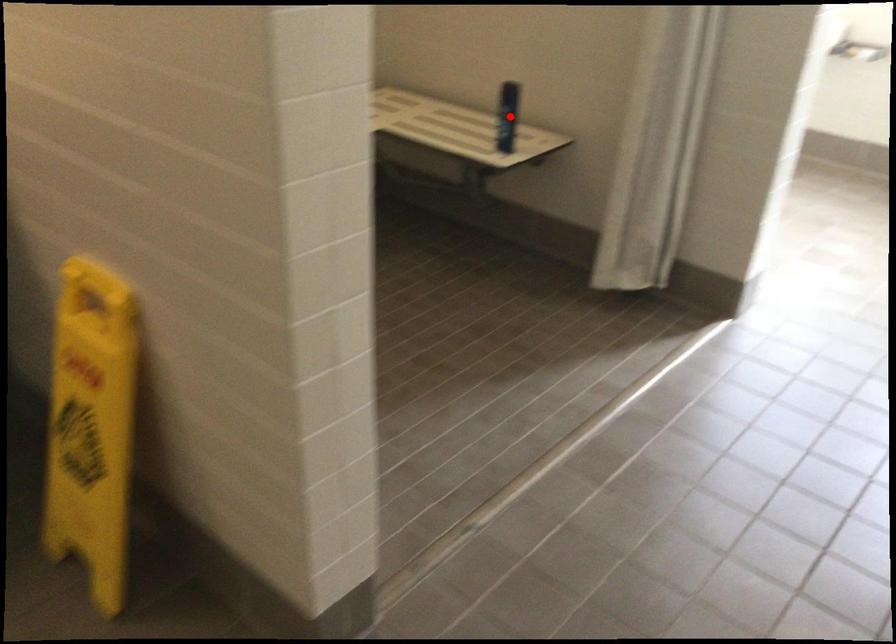
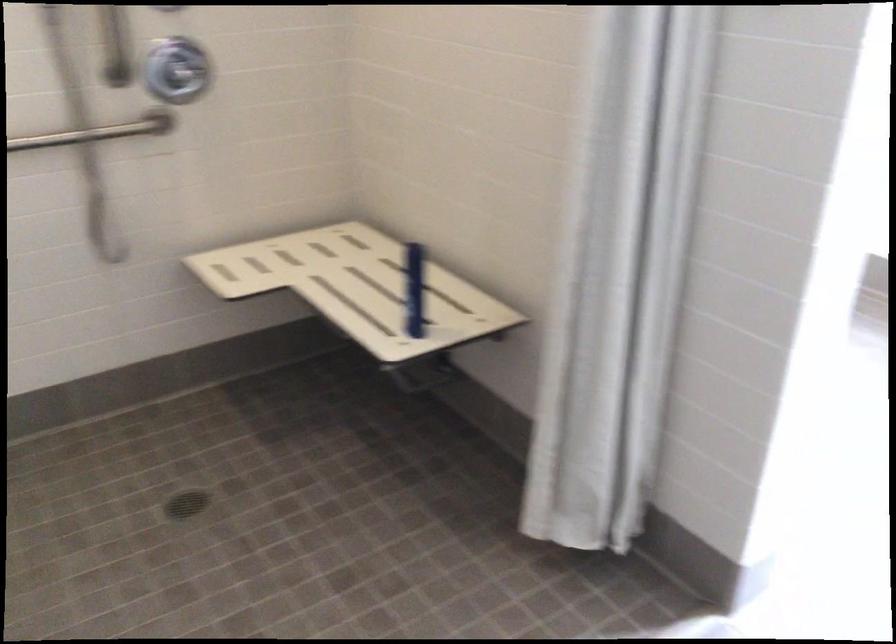
Find the pixel in the second image that matches the highlighted location in the first image.

(414, 289)